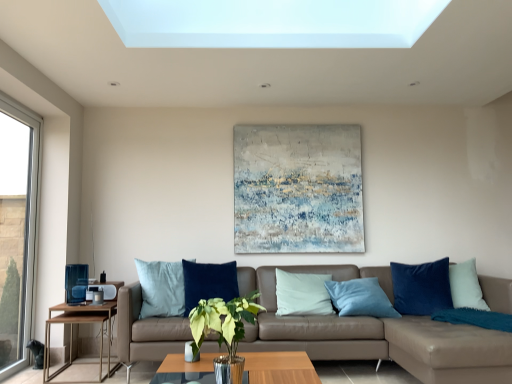
Question: From the image's perspective, is wooden/metallic side table at left above or below textured canvas painting at center?

Choices:
 (A) below
 (B) above

Answer: (A)

Question: Is wooden/metallic side table at left to the left or to the right of textured canvas painting at center in the image?

Choices:
 (A) right
 (B) left

Answer: (B)

Question: Which of these objects is positioned farthest from the leather couch at center?

Choices:
 (A) textured canvas painting at center
 (B) velvet blue pillow at right
 (C) wooden/metallic side table at left
 (D) green leafy plant in glass vase at center
 (E) clear glass window at left

Answer: (E)

Question: Which is nearer to the clear glass window at left?

Choices:
 (A) translucent glass coffee table at center
 (B) velvet blue pillow at right
 (C) leather couch at center
 (D) textured canvas painting at center
 (E) wooden/metallic side table at left

Answer: (E)